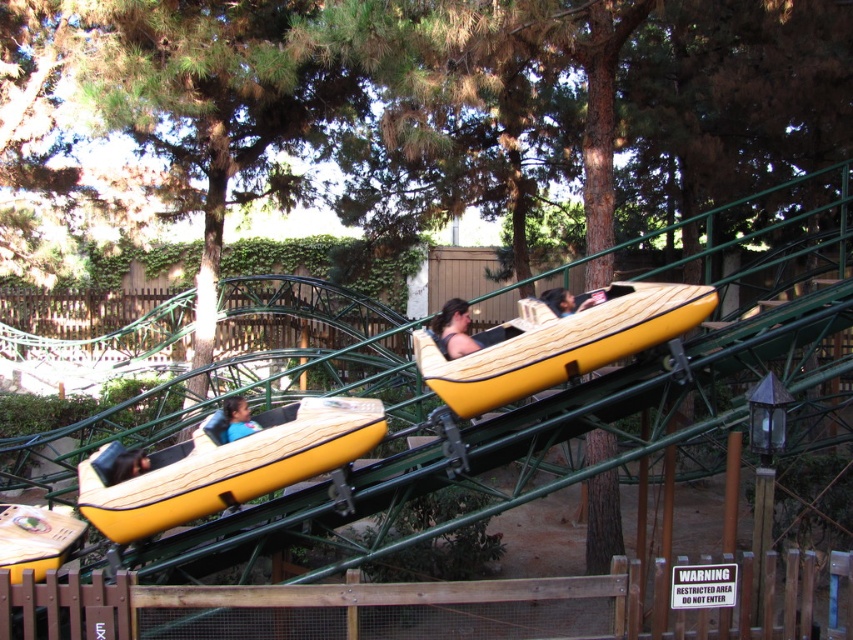
Question: Does matte yellow raft at left have a greater width compared to smooth tan helmet at center?

Choices:
 (A) yes
 (B) no

Answer: (B)

Question: Which point is closer to the camera?

Choices:
 (A) matte brown hair at center
 (B) matte yellow raft at lower left
 (C) matte yellow raft at left

Answer: (C)

Question: Which of the following is the farthest from the observer?

Choices:
 (A) wooden raft at center
 (B) matte yellow raft at left

Answer: (B)

Question: Observing the image, what is the correct spatial positioning of wooden raft at center in reference to matte yellow raft at lower left?

Choices:
 (A) right
 (B) left

Answer: (A)

Question: Which object is closer to the camera taking this photo?

Choices:
 (A) matte brown hair at center
 (B) matte yellow raft at lower left

Answer: (A)

Question: Is matte yellow raft at left behind matte brown hair at center?

Choices:
 (A) yes
 (B) no

Answer: (B)